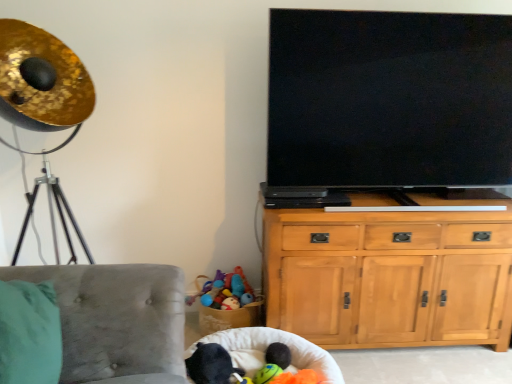
Question: From the image's perspective, is white fabric bean bag at lower center located above or below light wood cabinet at center right?

Choices:
 (A) below
 (B) above

Answer: (A)

Question: In terms of height, does white fabric bean bag at lower center look taller or shorter compared to light wood cabinet at center right?

Choices:
 (A) tall
 (B) short

Answer: (B)

Question: Which object is the farthest from the velvet grey chair at lower left?

Choices:
 (A) white fabric bean bag at lower center
 (B) light wood cabinet at center right
 (C) soft plush toy at lower center
 (D) flat screen tv at upper right
 (E) black plush toy at lower center

Answer: (D)

Question: Which is nearer to the black plush toy at lower center?

Choices:
 (A) white fabric bean bag at lower center
 (B) soft plush toy at lower center
 (C) light wood cabinet at center right
 (D) velvet grey chair at lower left
 (E) flat screen tv at upper right

Answer: (A)